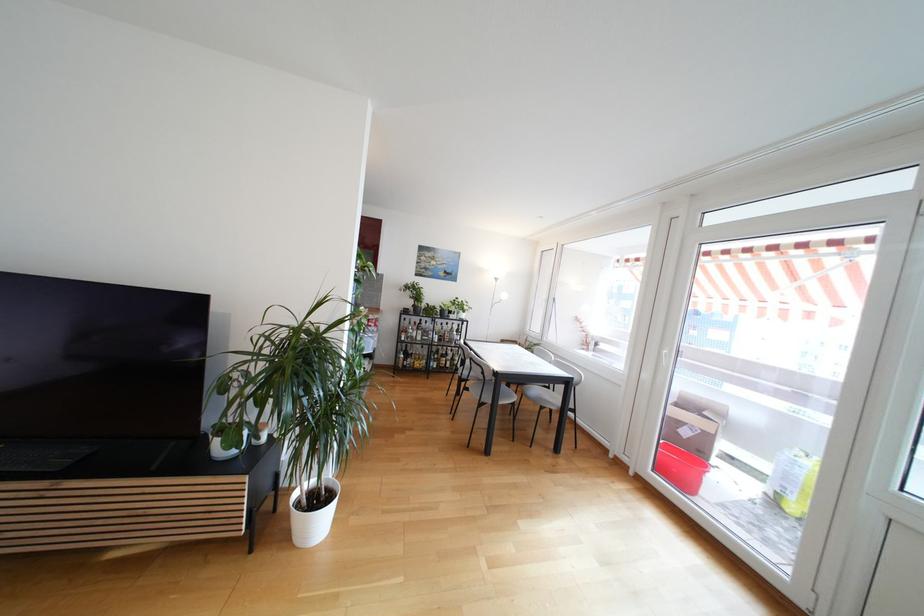
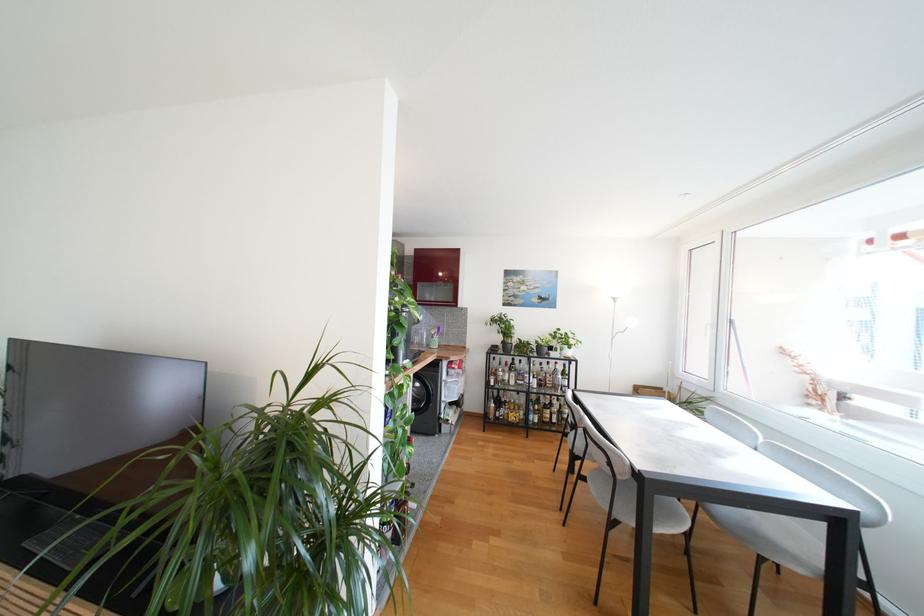
Find the pixel in the second image that matches (419,339) in the first image.

(513, 383)